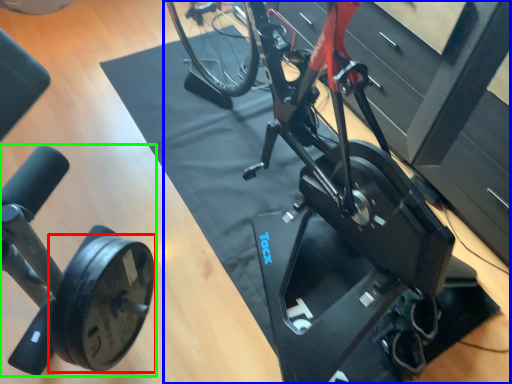
Question: Based on their relative distances, which object is farther from wheel (highlighted by a red box)? Choose from stationary bicycle (highlighted by a blue box) and stationary bicycle (highlighted by a green box).

Choices:
 (A) stationary bicycle
 (B) stationary bicycle

Answer: (A)